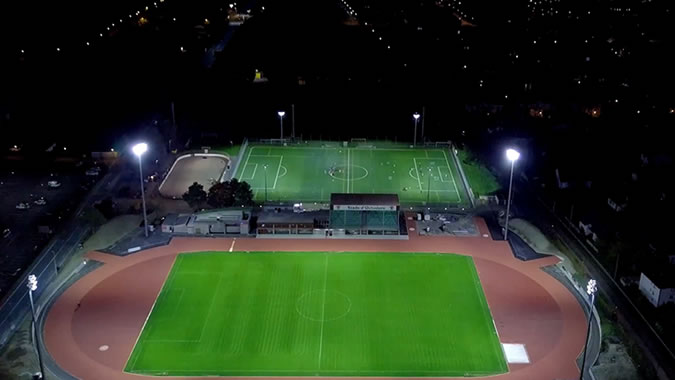
This screenshot has width=675, height=380. I want to click on light, so click(x=512, y=143).